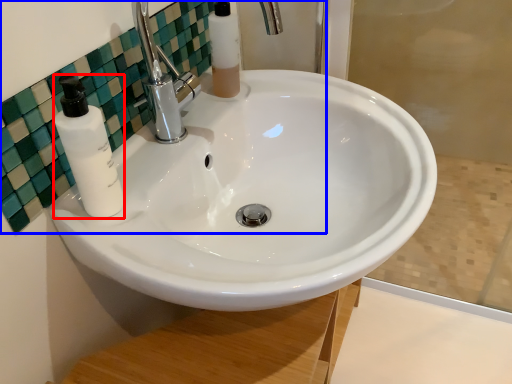
Question: Which of the following is the farthest to the observer, soap dispenser (highlighted by a red box) or mirror (highlighted by a blue box)?

Choices:
 (A) soap dispenser
 (B) mirror

Answer: (A)